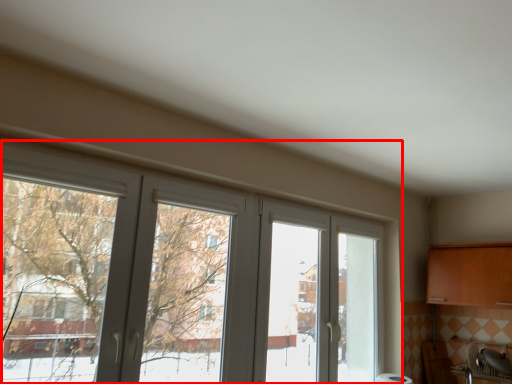
Question: From the image's perspective, what is the correct spatial relationship of window (annotated by the red box) in relation to sink?

Choices:
 (A) below
 (B) above

Answer: (B)